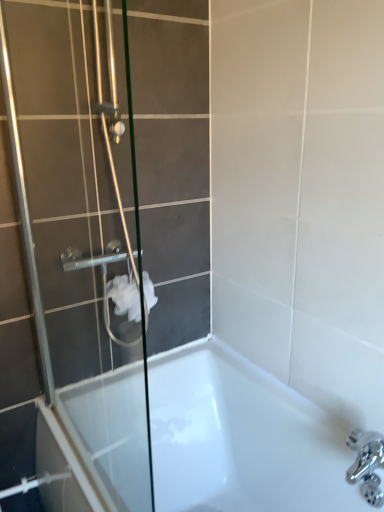
Question: From a real-world perspective, is white glossy bathtub at lower center below white matte toilet paper at center?

Choices:
 (A) no
 (B) yes

Answer: (B)

Question: Is white matte toilet paper at center completely or partially inside white glossy bathtub at lower center?

Choices:
 (A) yes
 (B) no

Answer: (B)

Question: Is white glossy bathtub at lower center bigger than white matte toilet paper at center?

Choices:
 (A) yes
 (B) no

Answer: (A)

Question: Is white glossy bathtub at lower center thinner than white matte toilet paper at center?

Choices:
 (A) no
 (B) yes

Answer: (A)

Question: From the image's perspective, is white glossy bathtub at lower center located above white matte toilet paper at center?

Choices:
 (A) yes
 (B) no

Answer: (B)

Question: Is clear glass shower door at left in front of or behind white matte toilet paper at center in the image?

Choices:
 (A) front
 (B) behind

Answer: (A)

Question: Is clear glass shower door at left taller or shorter than white matte toilet paper at center?

Choices:
 (A) short
 (B) tall

Answer: (B)

Question: Visually, is clear glass shower door at left positioned to the left or to the right of white matte toilet paper at center?

Choices:
 (A) right
 (B) left

Answer: (B)

Question: From the image's perspective, is clear glass shower door at left located above or below white matte toilet paper at center?

Choices:
 (A) below
 (B) above

Answer: (B)

Question: Based on their positions, is white glossy bathtub at lower center located to the left or right of clear glass shower door at left?

Choices:
 (A) right
 (B) left

Answer: (A)

Question: Is white glossy bathtub at lower center taller or shorter than clear glass shower door at left?

Choices:
 (A) tall
 (B) short

Answer: (B)

Question: Would you say white glossy bathtub at lower center is inside or outside clear glass shower door at left?

Choices:
 (A) outside
 (B) inside

Answer: (A)

Question: Considering the positions of white glossy bathtub at lower center and clear glass shower door at left in the image, is white glossy bathtub at lower center bigger or smaller than clear glass shower door at left?

Choices:
 (A) small
 (B) big

Answer: (B)

Question: Does point (6, 72) appear closer or farther from the camera than point (221, 375)?

Choices:
 (A) closer
 (B) farther

Answer: (A)

Question: From the image's perspective, is clear glass shower door at left positioned above or below white glossy bathtub at lower center?

Choices:
 (A) above
 (B) below

Answer: (A)